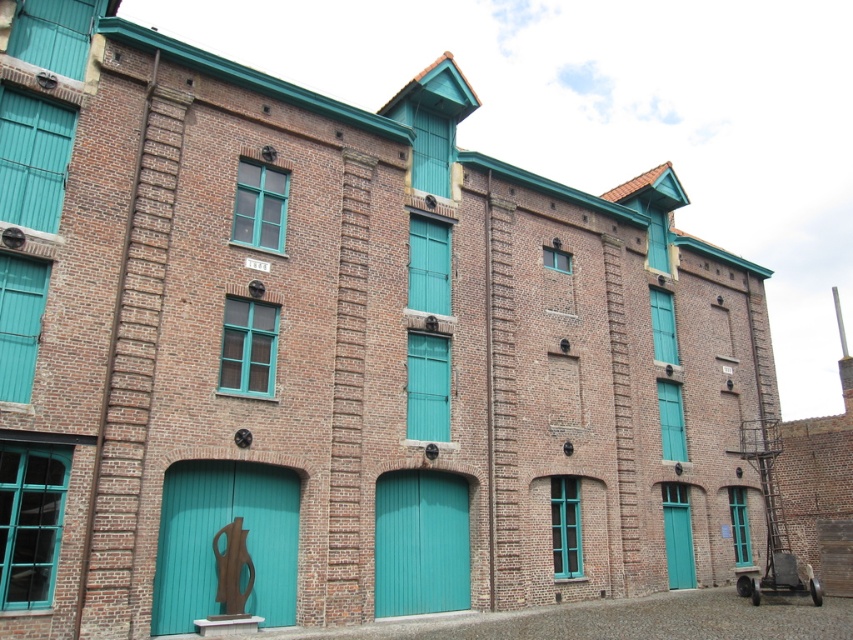
Does teal wooden door at lower left appear over teal matte door at center?

Indeed, teal wooden door at lower left is positioned over teal matte door at center.

Does teal wooden door at lower left appear under teal matte door at center?

Actually, teal wooden door at lower left is above teal matte door at center.

In order to click on teal wooden door at lower left in this screenshot , I will do `click(215, 532)`.

You are a GUI agent. You are given a task and a screenshot of the screen. Output one action in this format:
    pyautogui.click(x=<x>, y=<y>)
    Task: Click on the teal wooden door at lower left
    
    Given the screenshot: What is the action you would take?
    pyautogui.click(x=215, y=532)

Which is below, teal wooden door at lower left or teal matte/glossy door at center?

Positioned lower is teal matte/glossy door at center.

Can you confirm if teal wooden door at lower left is taller than teal matte/glossy door at center?

Indeed, teal wooden door at lower left has a greater height compared to teal matte/glossy door at center.

Is point (279, 525) closer to viewer compared to point (376, 545)?

Yes, point (279, 525) is closer to viewer.

What are the coordinates of `teal wooden door at lower left` in the screenshot? It's located at (215, 532).

Between teal matte/glossy door at center and teal matte door at center, which one has more height?

With more height is teal matte/glossy door at center.

Is point (467, 552) closer to camera compared to point (670, 513)?

Yes, it is.

Image resolution: width=853 pixels, height=640 pixels. In order to click on teal matte/glossy door at center in this screenshot , I will do `click(421, 541)`.

The image size is (853, 640). Identify the location of teal matte/glossy door at center. (421, 541).